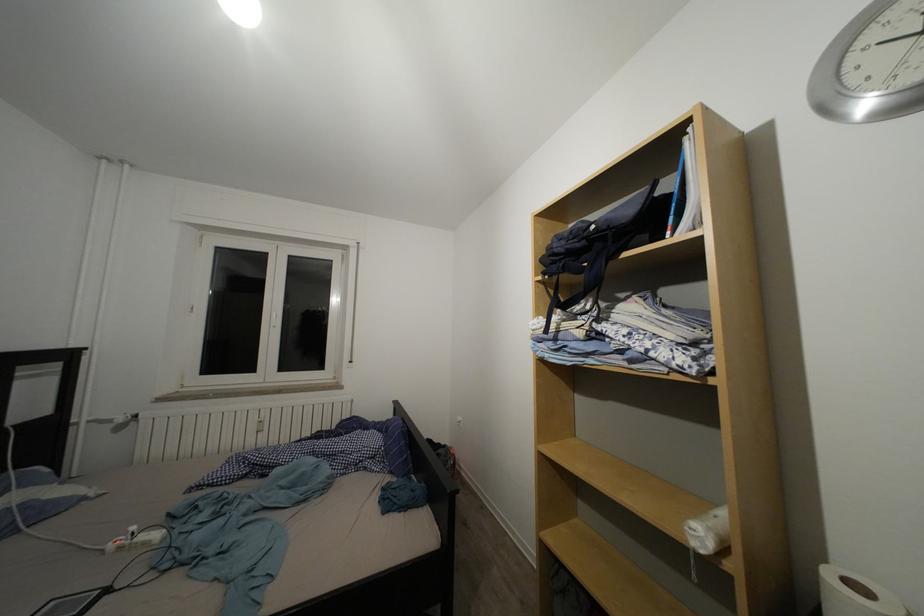
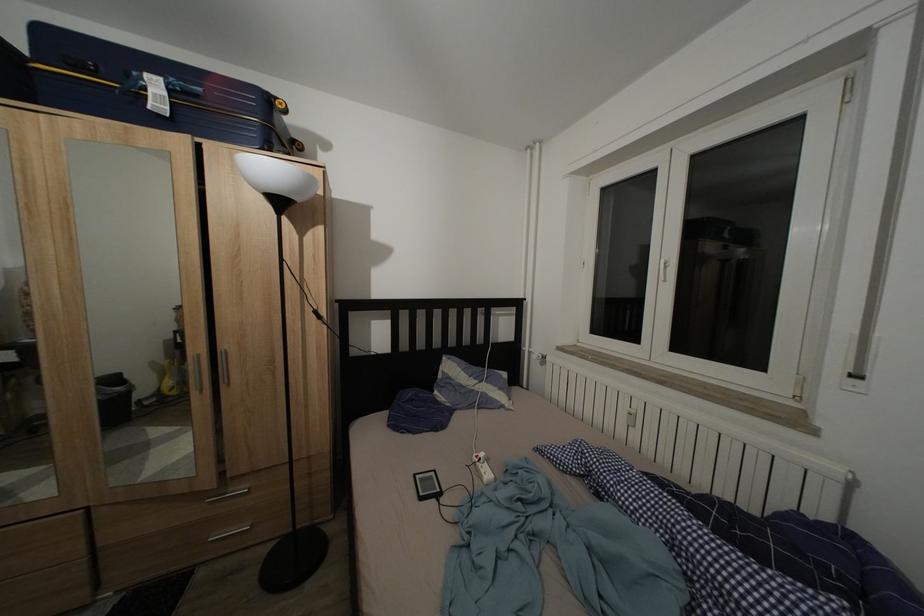
Where in the second image is the point corresponding to the point at 153,549 from the first image?

(488, 483)